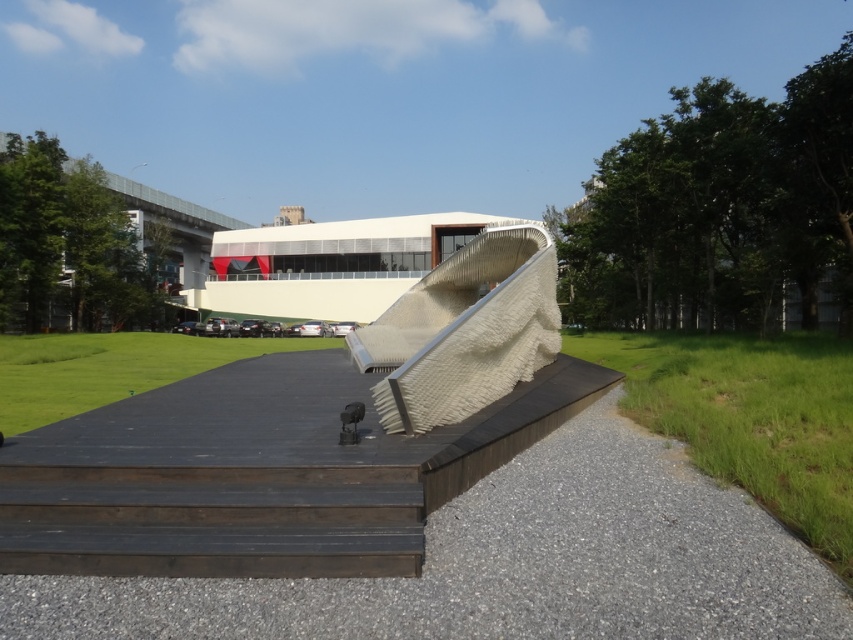
You are standing at the entrance of the outdoor area and see the gray gravel at lower center and the white textured ramp at center. Which object is nearer to you?

The gray gravel at lower center is closer to the viewer than the white textured ramp at center.